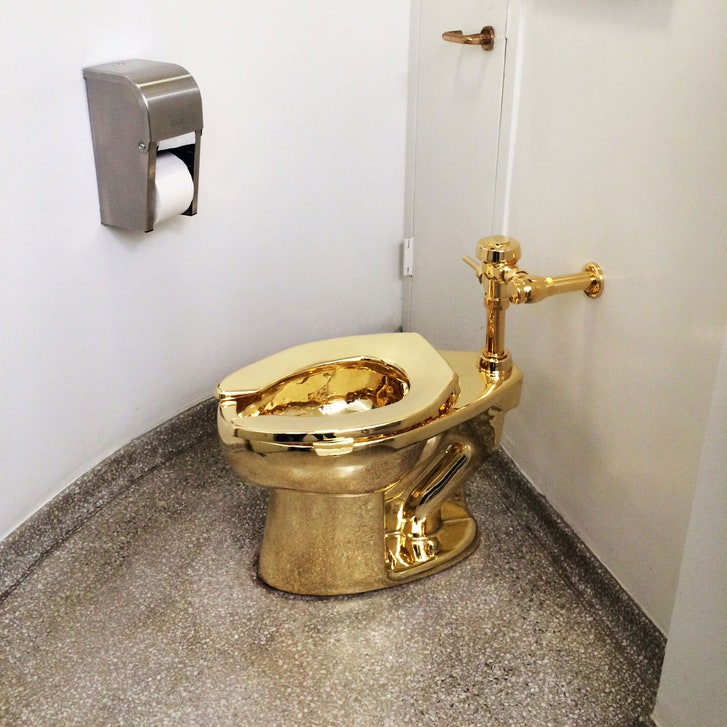
Locate an element on the screen. The image size is (727, 727). wall is located at coordinates (672, 326).